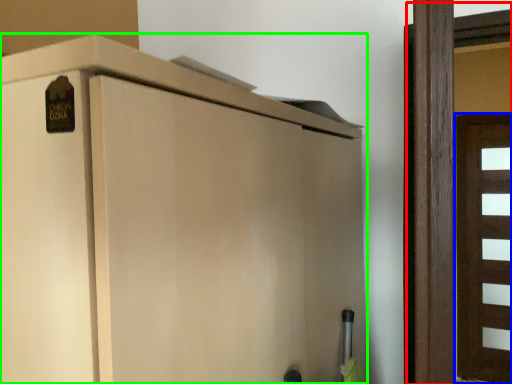
Question: Estimate the real-world distances between objects in this image. Which object is farther from door (highlighted by a red box), door (highlighted by a blue box) or cupboard (highlighted by a green box)?

Choices:
 (A) door
 (B) cupboard

Answer: (A)